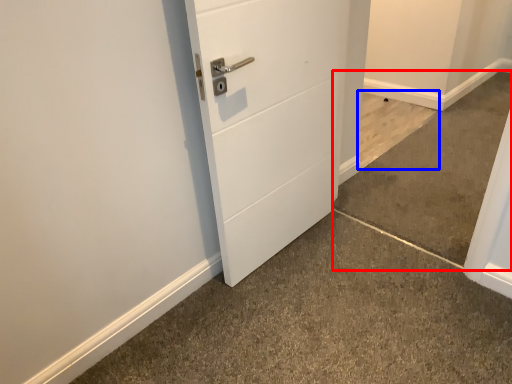
Question: Which of the following is the closest to the observer, concrete (highlighted by a red box) or concrete (highlighted by a blue box)?

Choices:
 (A) concrete
 (B) concrete

Answer: (A)